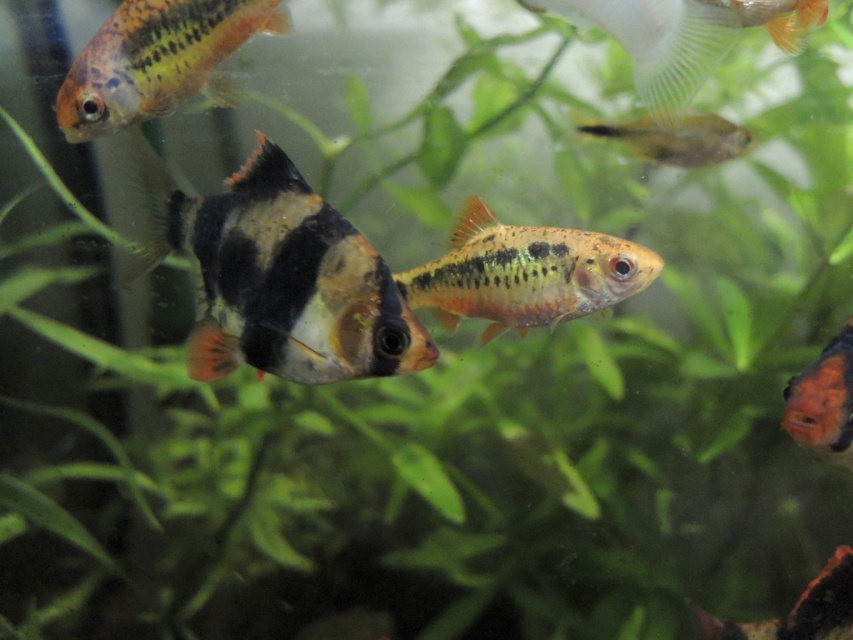
Question: Estimate the real-world distances between objects in this image. Which object is closer to the shiny orange fish at right?

Choices:
 (A) translucent plastic fin at upper right
 (B) black and orange fish at center

Answer: (A)

Question: From the image, what is the correct spatial relationship of shiny orange fish at right in relation to shiny orange fish at center?

Choices:
 (A) below
 (B) above

Answer: (B)

Question: Among these objects, which one is farthest from the camera?

Choices:
 (A) orange glossy fish at center
 (B) translucent yellowish-green fish at upper right
 (C) shiny orange fish at center
 (D) orange and black striped fish at upper left

Answer: (B)

Question: Does orange glossy fish at center come in front of translucent yellowish-green fish at upper right?

Choices:
 (A) no
 (B) yes

Answer: (B)

Question: Which is farther from the shiny orange fish at right?

Choices:
 (A) black and orange fish at center
 (B) orange and black striped fish at upper left

Answer: (B)

Question: Is orange glossy fish at center thinner than orange and black striped fish at upper left?

Choices:
 (A) yes
 (B) no

Answer: (B)